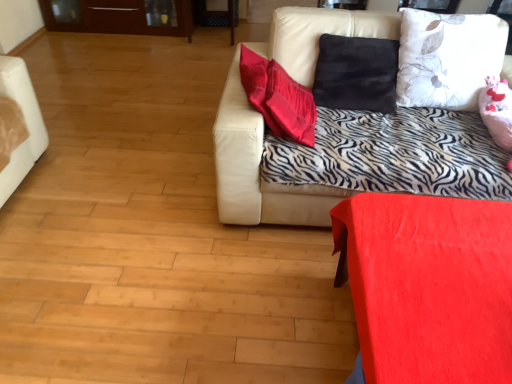
Question: Is leather couch at upper right shorter than matte red table at lower right?

Choices:
 (A) no
 (B) yes

Answer: (A)

Question: Is leather couch at upper right directly adjacent to matte red table at lower right?

Choices:
 (A) yes
 (B) no

Answer: (B)

Question: From the image's perspective, does leather couch at upper right appear lower than matte red table at lower right?

Choices:
 (A) no
 (B) yes

Answer: (A)

Question: Is leather couch at upper right facing away from matte red table at lower right?

Choices:
 (A) yes
 (B) no

Answer: (B)

Question: Can you confirm if leather couch at upper right is positioned to the left of matte red table at lower right?

Choices:
 (A) yes
 (B) no

Answer: (A)

Question: Is leather couch at upper right further to the viewer compared to matte red table at lower right?

Choices:
 (A) yes
 (B) no

Answer: (A)

Question: Is white floral fabric pillow at upper right positioned beyond the bounds of matte red table at lower right?

Choices:
 (A) yes
 (B) no

Answer: (A)

Question: Is white floral fabric pillow at upper right at the left side of matte red table at lower right?

Choices:
 (A) yes
 (B) no

Answer: (B)

Question: Is white floral fabric pillow at upper right looking in the opposite direction of matte red table at lower right?

Choices:
 (A) no
 (B) yes

Answer: (A)

Question: Is white floral fabric pillow at upper right not close to matte red table at lower right?

Choices:
 (A) no
 (B) yes

Answer: (A)

Question: Does white floral fabric pillow at upper right have a smaller size compared to matte red table at lower right?

Choices:
 (A) no
 (B) yes

Answer: (B)

Question: Can you confirm if white floral fabric pillow at upper right is taller than matte red table at lower right?

Choices:
 (A) yes
 (B) no

Answer: (A)

Question: Is white floral fabric pillow at upper right not inside leather couch at upper right?

Choices:
 (A) no
 (B) yes

Answer: (A)